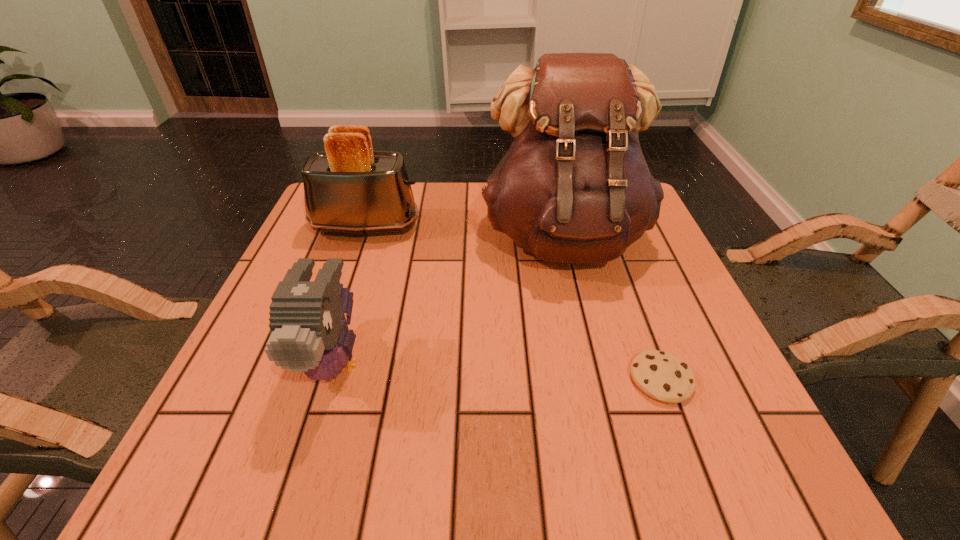
You are a GUI agent. You are given a task and a screenshot of the screen. Output one action in this format:
    pyautogui.click(x=<x>, y=<y>)
    Task: Click on the toaster located at the left edge
    The height and width of the screenshot is (540, 960).
    Given the screenshot: What is the action you would take?
    pyautogui.click(x=349, y=188)

At what (x,y) coordinates should I click in order to perform the action: click on bird at the left edge. Please return your answer as a coordinate pair (x, y). This screenshot has width=960, height=540. Looking at the image, I should click on (309, 333).

Find the location of a particular element. satchel located in the right edge section of the desktop is located at coordinates (574, 187).

Find the location of a particular element. Image resolution: width=960 pixels, height=540 pixels. cookie that is positioned at the right edge is located at coordinates (663, 376).

Where is `object at the far left corner`? This screenshot has height=540, width=960. object at the far left corner is located at coordinates (349, 188).

Locate an element on the screen. This screenshot has width=960, height=540. object that is at the far right corner is located at coordinates (574, 187).

The image size is (960, 540). In the image, there is a desktop. What are the coordinates of `vacant space at the far edge` in the screenshot? It's located at (435, 218).

In the image, there is a desktop. Identify the location of vacant space at the near edge. This screenshot has width=960, height=540. (312, 430).

Where is `free space at the left edge of the desktop`? The width and height of the screenshot is (960, 540). free space at the left edge of the desktop is located at coordinates (221, 428).

I want to click on vacant space at the right edge of the desktop, so click(x=688, y=347).